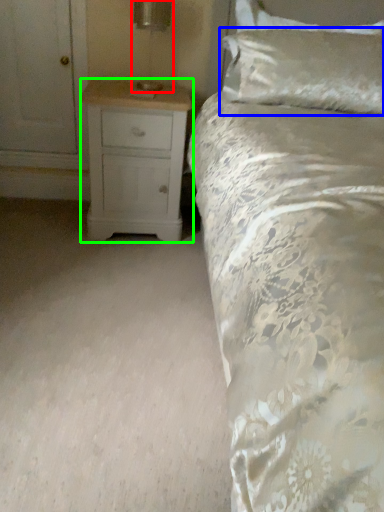
Question: Estimate the real-world distances between objects in this image. Which object is closer to table lamp (highlighted by a red box), pillow (highlighted by a blue box) or chest of drawers (highlighted by a green box)?

Choices:
 (A) pillow
 (B) chest of drawers

Answer: (B)